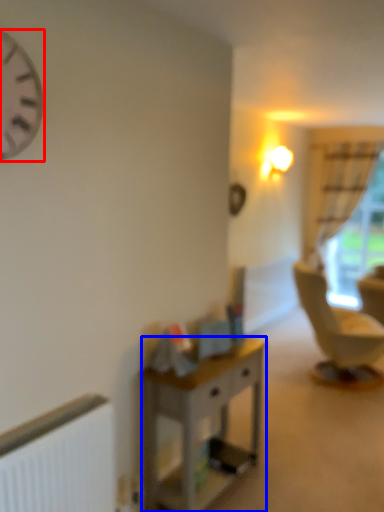
Question: Which object is further to the camera taking this photo, clock (highlighted by a red box) or desk (highlighted by a blue box)?

Choices:
 (A) clock
 (B) desk

Answer: (B)